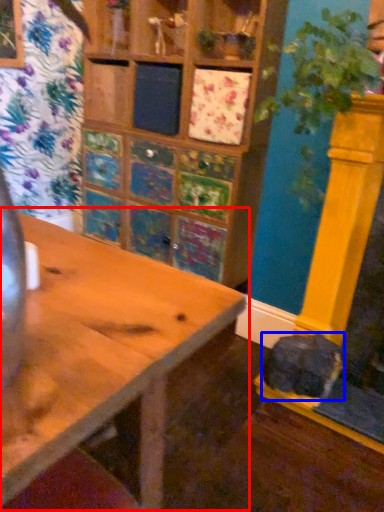
Question: Which of the following is the closest to the observer, table (highlighted by a red box) or animal (highlighted by a blue box)?

Choices:
 (A) table
 (B) animal

Answer: (A)